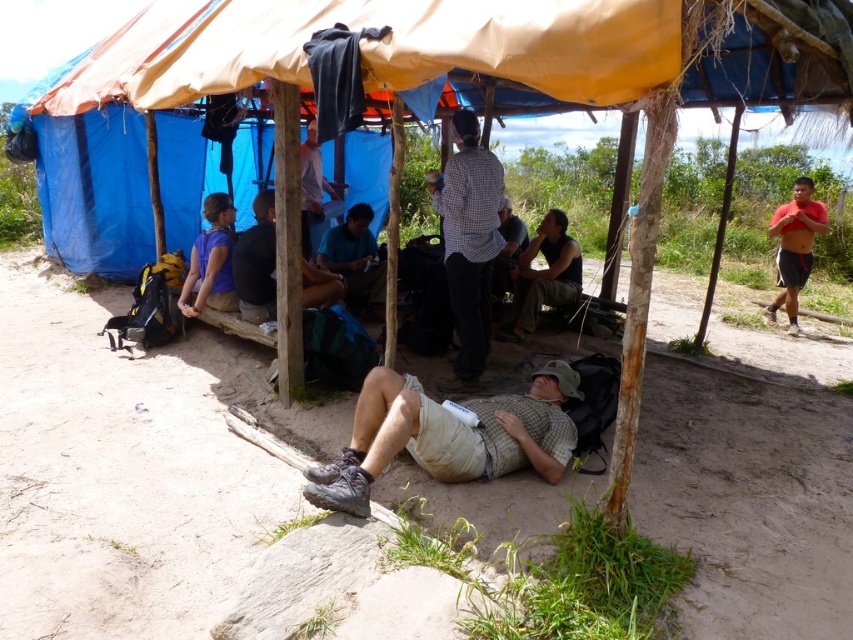
You are standing in front of the shelter and want to take a photo. The two points you are focusing on are point [335,300] and point [360,204]. Which point should you focus on to ensure it appears larger in your photo?

Point [335,300] is closer to the camera than point [360,204], so focusing on point [335,300] will make it appear larger in the photo.

You are a photographer standing outside the shelter. You want to take a photo of the dark green fabric shirt at center and the light brown wooden bench at center so that both are fully visible in the frame. Which object should you focus on first to ensure proper focus on both?

You should focus on the light brown wooden bench at center first because it is taller than the dark green fabric shirt at center, ensuring both will be in focus when focusing on the farther object.

You are a photographer aiming to capture a photo of the dark green fabric shirt at center and the light brown wooden bench at center. Which object should you focus on first if you want to ensure both are in sharp focus?

The dark green fabric shirt at center is below the light brown wooden bench at center, so you should focus on the light brown wooden bench at center first to ensure both are in sharp focus.